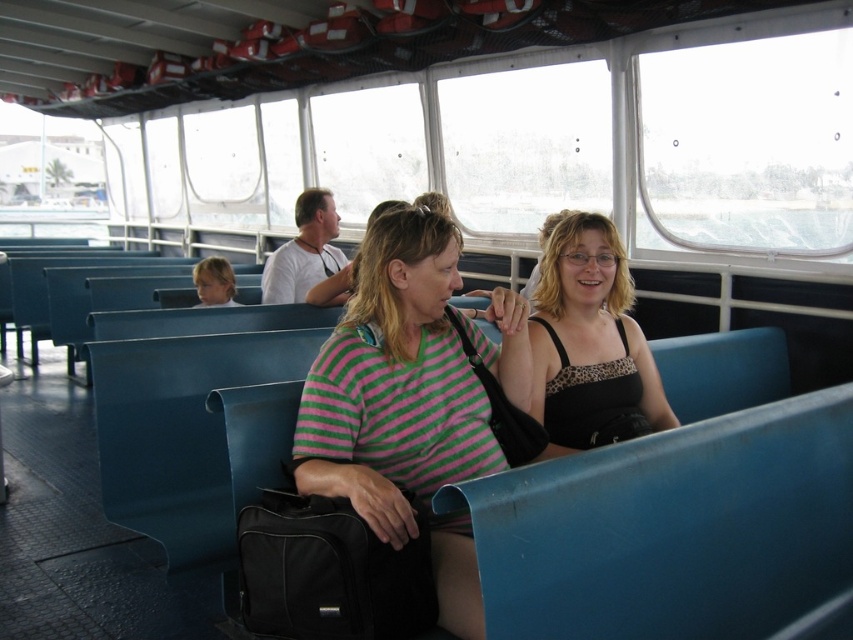
Is leopard print tank top at center further to camera compared to blonde hair at left?

That is False.

Describe the element at coordinates (590, 342) in the screenshot. I see `leopard print tank top at center` at that location.

Find the location of `leopard print tank top at center`. leopard print tank top at center is located at coordinates (590, 342).

Is striped cotton shirt at center thinner than white matte shirt at upper center?

Answer: No.

Does striped cotton shirt at center lie in front of white matte shirt at upper center?

That is True.

Which is behind, point (334, 442) or point (300, 200)?

The point (300, 200) is behind.

Find the location of `striped cotton shirt at center`. striped cotton shirt at center is located at coordinates (405, 380).

How distant is leopard print tank top at center from white matte shirt at upper center?

leopard print tank top at center and white matte shirt at upper center are 1.98 meters apart from each other.

What do you see at coordinates (590, 342) in the screenshot? The width and height of the screenshot is (853, 640). I see `leopard print tank top at center` at bounding box center [590, 342].

Does point (544, 260) come behind point (312, 220)?

No, it is in front of (312, 220).

You are a GUI agent. You are given a task and a screenshot of the screen. Output one action in this format:
    pyautogui.click(x=<x>, y=<y>)
    Task: Click on the leopard print tank top at center
    The height and width of the screenshot is (640, 853).
    Given the screenshot: What is the action you would take?
    pyautogui.click(x=590, y=342)